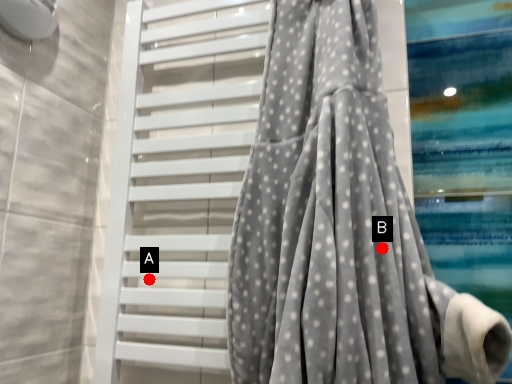
Question: Two points are circled on the image, labeled by A and B beside each circle. Which point is further to the camera?

Choices:
 (A) A is further
 (B) B is further

Answer: (A)